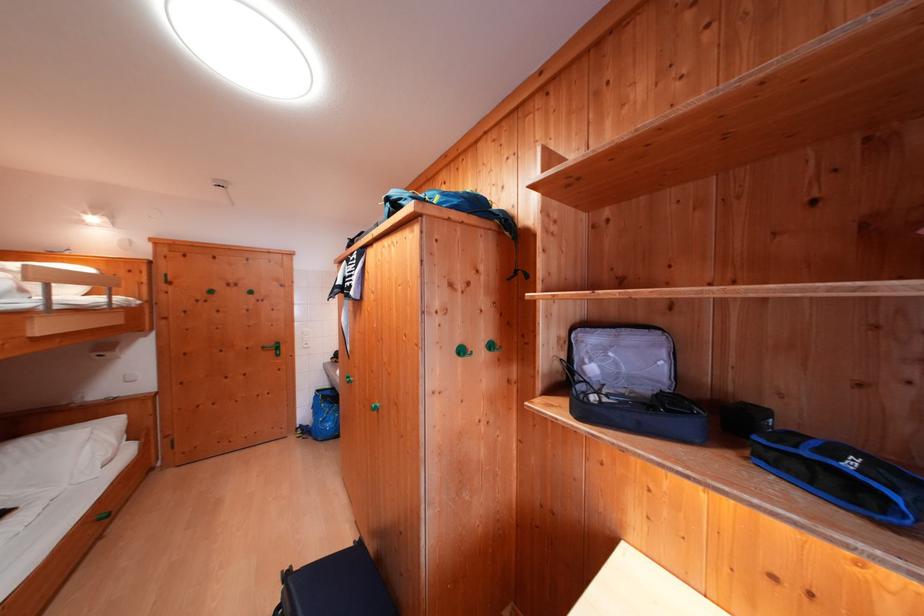
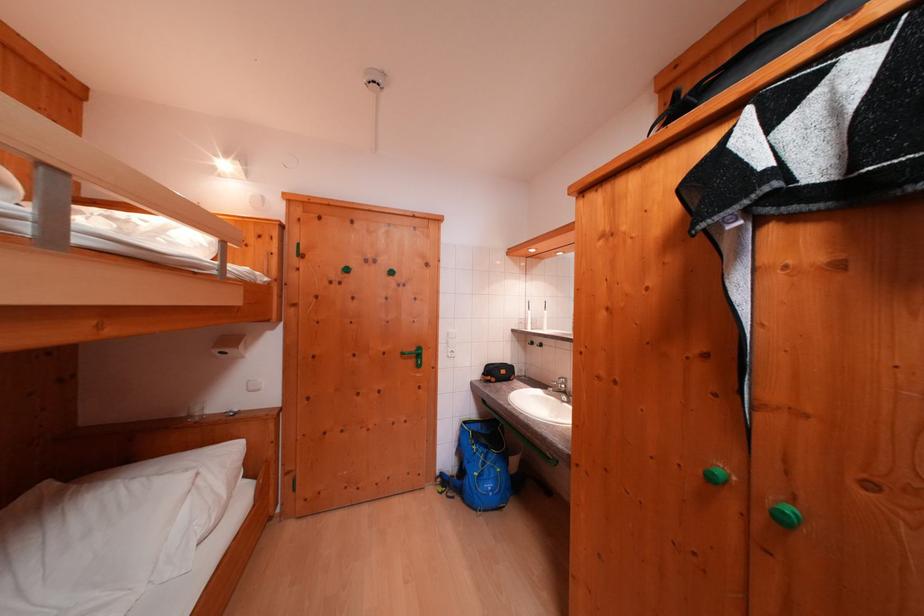
What movement of the cameraman would produce the second image?

The cameraman moved toward left, forward.